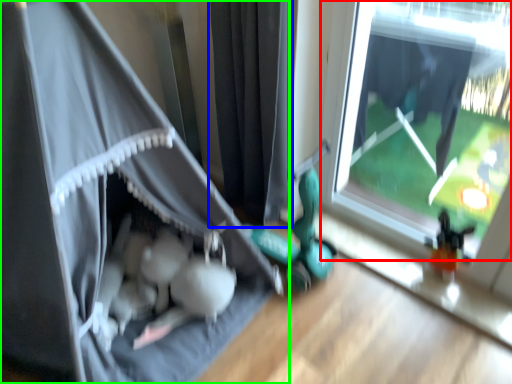
Question: Estimate the real-world distances between objects in this image. Which object is closer to window (highlighted by a red box), curtain (highlighted by a blue box) or curtain (highlighted by a green box)?

Choices:
 (A) curtain
 (B) curtain

Answer: (A)